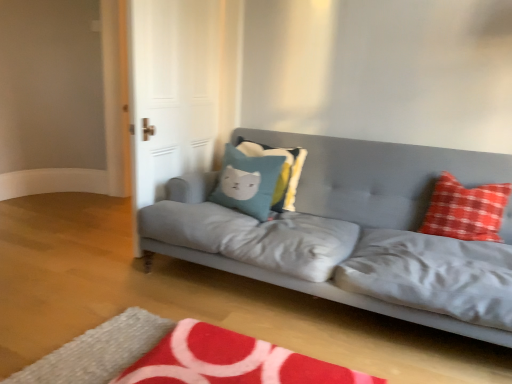
Question: Is white glossy door at upper left positioned before matte gray couch at center?

Choices:
 (A) yes
 (B) no

Answer: (B)

Question: Is white glossy door at upper left thinner than matte gray couch at center?

Choices:
 (A) yes
 (B) no

Answer: (A)

Question: Considering the relative positions of white glossy door at upper left and matte gray couch at center in the image provided, is white glossy door at upper left to the left of matte gray couch at center from the viewer's perspective?

Choices:
 (A) yes
 (B) no

Answer: (A)

Question: Considering the relative sizes of white glossy door at upper left and matte gray couch at center in the image provided, is white glossy door at upper left bigger than matte gray couch at center?

Choices:
 (A) yes
 (B) no

Answer: (B)

Question: Is white glossy door at upper left positioned with its back to matte gray couch at center?

Choices:
 (A) no
 (B) yes

Answer: (B)

Question: Is red checkered pillow at right, acting as the 3th pillow starting from the left, bigger or smaller than red plush rug at lower center?

Choices:
 (A) big
 (B) small

Answer: (B)

Question: From the image's perspective, is red checkered pillow at right, acting as the 3th pillow starting from the left, located above or below red plush rug at lower center?

Choices:
 (A) below
 (B) above

Answer: (B)

Question: Considering the positions of red checkered pillow at right, which is the first pillow in right-to-left order, and red plush rug at lower center in the image, is red checkered pillow at right, which is the first pillow in right-to-left order, wider or thinner than red plush rug at lower center?

Choices:
 (A) wide
 (B) thin

Answer: (B)

Question: Visually, is red checkered pillow at right, acting as the 3th pillow starting from the left, positioned to the left or to the right of red plush rug at lower center?

Choices:
 (A) right
 (B) left

Answer: (A)

Question: From a real-world perspective, is red checkered pillow at right, acting as the 3th pillow starting from the left, positioned above or below teal fabric pillow with cat design at center, which appears as the third pillow when viewed from the right?

Choices:
 (A) below
 (B) above

Answer: (B)

Question: In terms of width, does red checkered pillow at right, acting as the 3th pillow starting from the left, look wider or thinner when compared to teal fabric pillow with cat design at center, the first pillow positioned from the left?

Choices:
 (A) wide
 (B) thin

Answer: (B)

Question: Considering the positions of red checkered pillow at right, acting as the 3th pillow starting from the left, and teal fabric pillow with cat design at center, which appears as the third pillow when viewed from the right, in the image, is red checkered pillow at right, acting as the 3th pillow starting from the left, bigger or smaller than teal fabric pillow with cat design at center, which appears as the third pillow when viewed from the right,?

Choices:
 (A) small
 (B) big

Answer: (A)

Question: Is red checkered pillow at right, which is the first pillow in right-to-left order, situated inside teal fabric pillow with cat design at center, the first pillow positioned from the left, or outside?

Choices:
 (A) inside
 (B) outside

Answer: (B)

Question: Considering the positions of red plush rug at lower center and white glossy door at upper left in the image, is red plush rug at lower center wider or thinner than white glossy door at upper left?

Choices:
 (A) wide
 (B) thin

Answer: (A)

Question: In the image, is red plush rug at lower center positioned in front of or behind white glossy door at upper left?

Choices:
 (A) behind
 (B) front

Answer: (B)